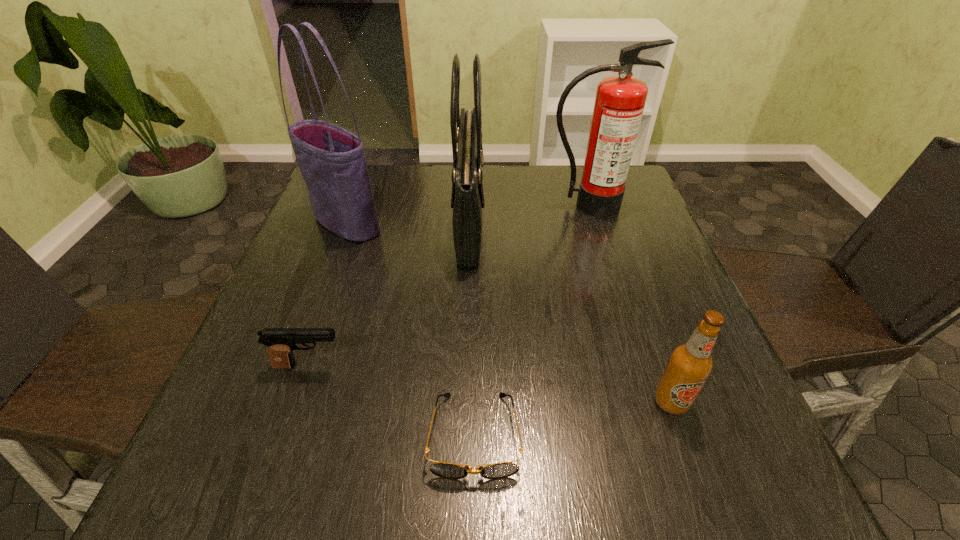
You are a GUI agent. You are given a task and a screenshot of the screen. Output one action in this format:
    pyautogui.click(x=<x>, y=<y>)
    Task: Click on the free space located on the front label of the third shortest object
    The height and width of the screenshot is (540, 960).
    Given the screenshot: What is the action you would take?
    pyautogui.click(x=701, y=487)

Locate an element on the screen. blank space located 0.390m at the barrel of the fifth tallest object is located at coordinates (557, 366).

At what (x,y) coordinates should I click in order to perform the action: click on tote bag that is at the far edge. Please return your answer as a coordinate pair (x, y). The height and width of the screenshot is (540, 960). Looking at the image, I should click on (332, 161).

This screenshot has height=540, width=960. In order to click on fire extinguisher that is at the far edge in this screenshot , I will do `click(620, 100)`.

At what (x,y) coordinates should I click in order to perform the action: click on handbag that is at the far edge. Please return your answer as a coordinate pair (x, y). Looking at the image, I should click on (467, 201).

Locate an element on the screen. This screenshot has height=540, width=960. object located in the near edge section of the desktop is located at coordinates (446, 470).

You are a GUI agent. You are given a task and a screenshot of the screen. Output one action in this format:
    pyautogui.click(x=<x>, y=<y>)
    Task: Click on the tote bag at the left edge
    The width and height of the screenshot is (960, 540).
    Given the screenshot: What is the action you would take?
    (332, 161)

You are a GUI agent. You are given a task and a screenshot of the screen. Output one action in this format:
    pyautogui.click(x=<x>, y=<y>)
    Task: Click on the pistol that is at the left edge
    
    Given the screenshot: What is the action you would take?
    pyautogui.click(x=281, y=342)

I want to click on fire extinguisher at the right edge, so click(620, 100).

Identify the location of beer bottle that is at the right edge. The width and height of the screenshot is (960, 540). (690, 364).